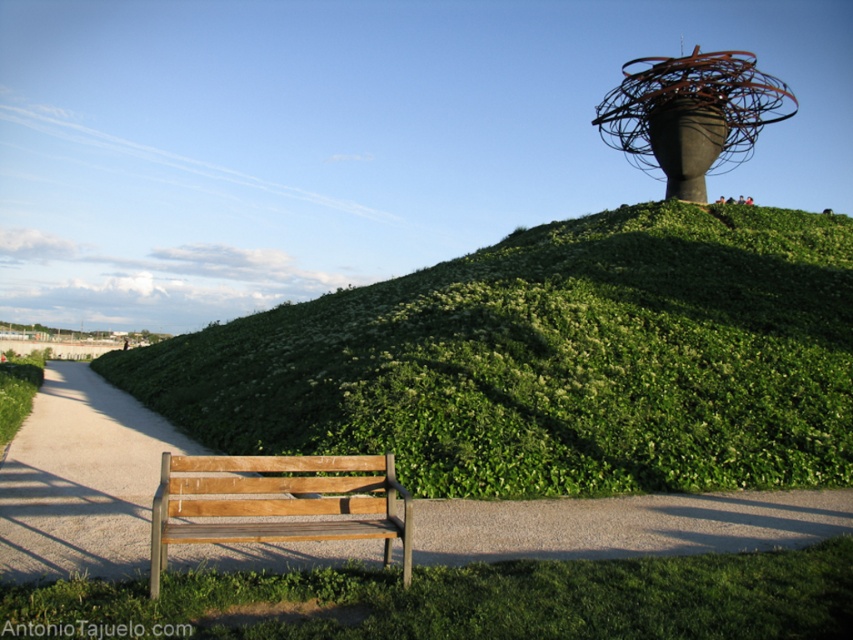
You are standing at the wooden bench with a simple design on the grassy area. Looking towards the paved pathway, where is the green grassy hillside at upper center located relative to your position?

The green grassy hillside at upper center is located at point coordinates of (x=550, y=360) in the scene.

You are planning to place a new bench that is twice as wide as the wooden park bench at lower left. Based on the scene, would the green grassy hillside at upper center be wide enough to accommodate this new bench?

The green grassy hillside at upper center is wider than the wooden park bench at lower left. Since the new bench is twice as wide as the wooden park bench at lower left, the hillside may still be wide enough depending on the exact dimensions, but the description only confirms the hillside is wider than the original bench, not by how much. Therefore, we cannot definitively confirm if it can accommodate the larger bench without more specific measurements.